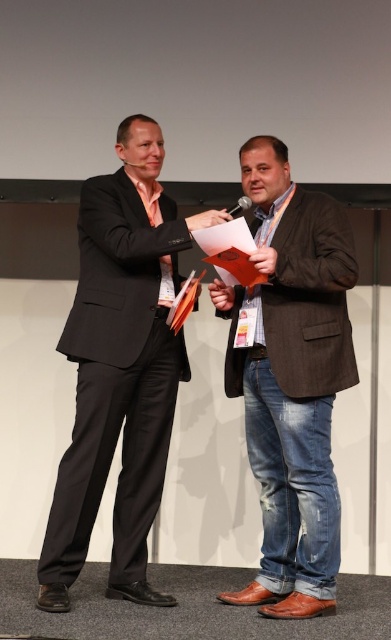
You are a photographer adjusting your camera to focus on two points on the stage. The first point is at coordinates point (80, 225) and the second point is at point (315, 410). Which point should you focus on first if you want to start with the one closer to the camera?

Point (80, 225) is closer to the camera than point (315, 410), so you should focus on point (80, 225) first.

You are an event organizer who needs to ensure that the stage setup is safe for all participants. Based on the scene, is the matte black suit at left blocking the brown leather shoes at center from being seen by the audience?

The matte black suit at left is positioned over brown leather shoes at center, so it is blocking the shoes from the audience view.

You are an event photographer positioned at the back of the stage. You want to capture a clear photo of the matte black suit at left and the brown leather shoes at center. Which object should you focus on first to ensure both are in focus?

The matte black suit at left is in front of the brown leather shoes at center, so you should focus on the matte black suit at left first to ensure both are in focus.